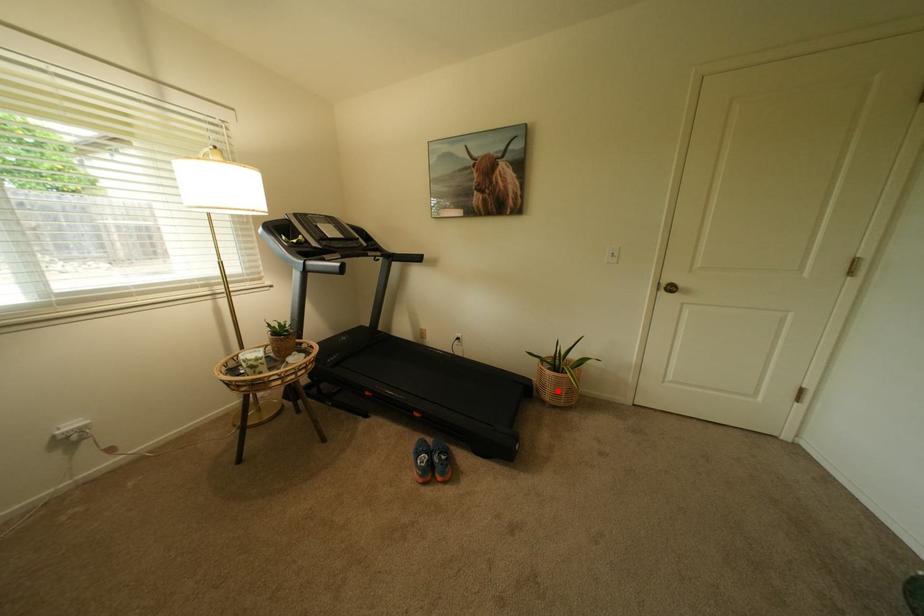
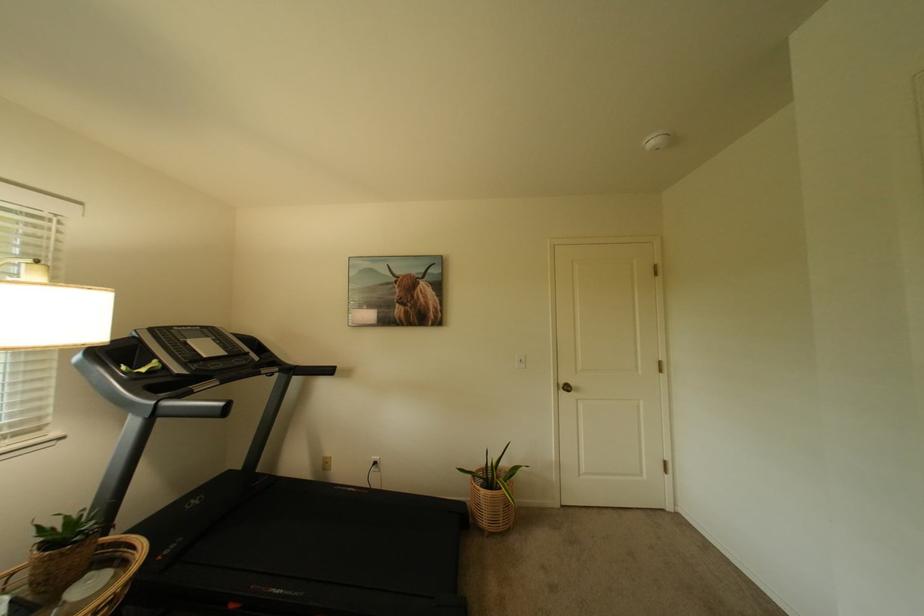
Question: I am providing you with two images of the same scene from different viewpoints. In image1, a red point is highlighted. Considering the same 3D point in image2, which of the following is correct?

Choices:
 (A) It is closer
 (B) It is farther

Answer: (B)